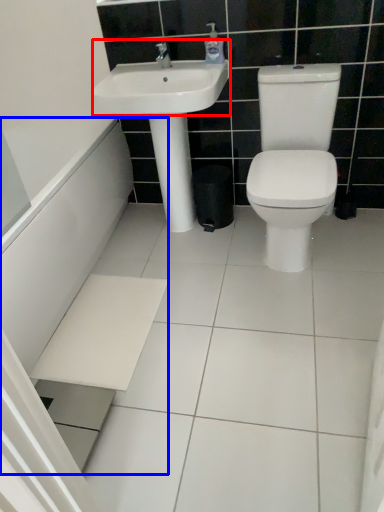
Question: Which of the following is the farthest to the observer, sink (highlighted by a red box) or bath (highlighted by a blue box)?

Choices:
 (A) sink
 (B) bath

Answer: (A)